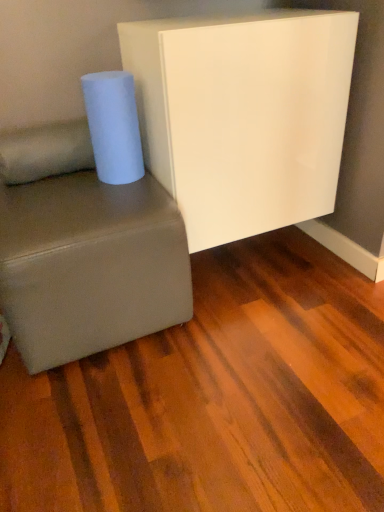
Find the location of `vacant area that lies between white matte paper towel at left and soft beige fabric pillow at lower left`. vacant area that lies between white matte paper towel at left and soft beige fabric pillow at lower left is located at coordinates (61, 183).